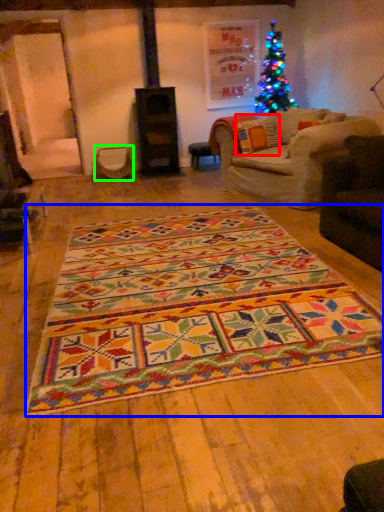
Question: Based on their relative distances, which object is nearer to pillow (highlighted by a red box)? Choose from mat (highlighted by a blue box) and swivel chair (highlighted by a green box).

Choices:
 (A) mat
 (B) swivel chair

Answer: (B)